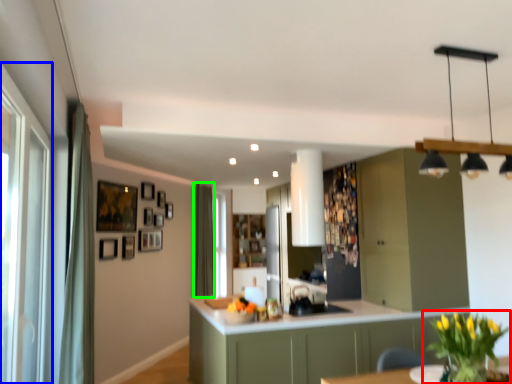
Question: Which object is positioned farthest from houseplant (highlighted by a red box)? Select from glass door (highlighted by a blue box) and curtain (highlighted by a green box).

Choices:
 (A) glass door
 (B) curtain

Answer: (B)